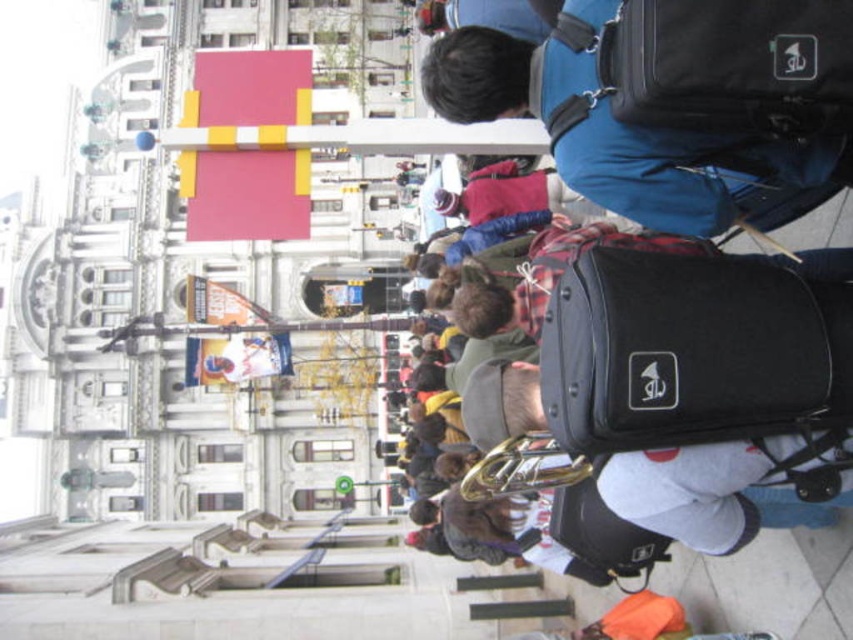
Question: Estimate the real-world distances between objects in this image. Which object is closer to the blue fabric backpack at upper right?

Choices:
 (A) black fabric suitcase at right
 (B) black fabric suitcase at center

Answer: (A)

Question: Is blue fabric backpack at upper right closer to the viewer compared to gold shiny trumpet at center?

Choices:
 (A) yes
 (B) no

Answer: (A)

Question: Which point is farther from the camera taking this photo?

Choices:
 (A) (601, 355)
 (B) (828, 92)
 (C) (492, 480)

Answer: (C)

Question: Does black fabric suitcase at right have a smaller size compared to gold shiny trumpet at center?

Choices:
 (A) no
 (B) yes

Answer: (B)

Question: Which is farther from the black fabric suitcase at center?

Choices:
 (A) blue fabric backpack at upper right
 (B) black fabric suitcase at right
 (C) gold shiny trumpet at center

Answer: (B)

Question: Is black fabric suitcase at center below gold shiny trumpet at center?

Choices:
 (A) no
 (B) yes

Answer: (A)